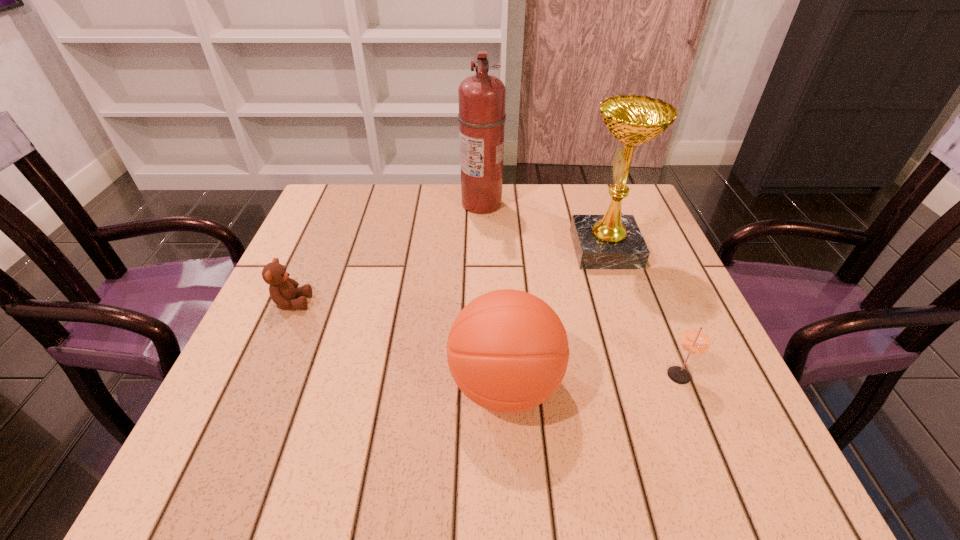
Identify the location of vacant space situated 0.130m on the front-facing side of the farthest object. (413, 204).

Locate an element on the screen. vacant space located 0.190m on the front-facing side of the second farthest object is located at coordinates (494, 249).

Locate an element on the screen. This screenshot has width=960, height=540. vacant area located 0.290m on the front-facing side of the second farthest object is located at coordinates coord(453,249).

Identify the location of blank space located 0.380m on the front-facing side of the second farthest object. Image resolution: width=960 pixels, height=540 pixels. (415, 249).

At what (x,y) coordinates should I click in order to perform the action: click on blank space located on the right of the third shortest object. Please return your answer as a coordinate pair (x, y). The width and height of the screenshot is (960, 540). Looking at the image, I should click on (630, 385).

Locate an element on the screen. This screenshot has width=960, height=540. vacant space positioned on the back of the straw is located at coordinates (630, 253).

Locate an element on the screen. The width and height of the screenshot is (960, 540). vacant space located 0.300m on the face of the teddy bear is located at coordinates click(454, 302).

Image resolution: width=960 pixels, height=540 pixels. I want to click on fire extinguisher located at the far edge, so click(x=481, y=97).

At what (x,y) coordinates should I click in order to perform the action: click on award that is positioned at the far edge. Please return your answer as a coordinate pair (x, y). Looking at the image, I should click on (612, 241).

Locate an element on the screen. object at the near edge is located at coordinates (507, 350).